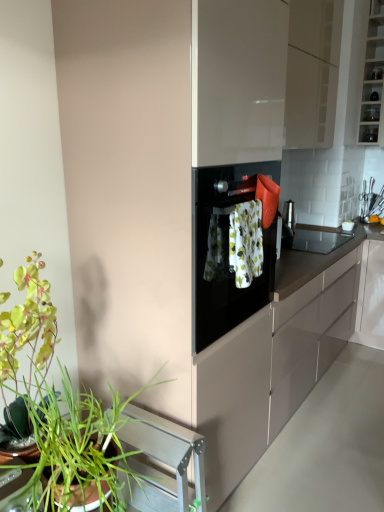
What is the approximate width of green leafy plant at lower left?

green leafy plant at lower left is 19.65 inches in width.

What is the approximate width of clear glass shelves at upper right, the first cabinetry in the right-to-left sequence?

The width of clear glass shelves at upper right, the first cabinetry in the right-to-left sequence, is 12.32 inches.

I want to click on green leafy plant at lower left, so click(x=50, y=394).

Is glossy beige cabinet at upper center, which appears as the second cabinetry when viewed from the right, further to camera compared to clear glass shelves at upper right, the first cabinetry in the right-to-left sequence?

No, glossy beige cabinet at upper center, which appears as the second cabinetry when viewed from the right, is in front of clear glass shelves at upper right, the first cabinetry in the right-to-left sequence.

The height and width of the screenshot is (512, 384). Identify the location of cabinetry on the left of clear glass shelves at upper right, the first cabinetry in the right-to-left sequence. (312, 72).

Considering the relative positions of glossy beige cabinet at upper center, which appears as the second cabinetry when viewed from the right, and clear glass shelves at upper right, marked as the 2th cabinetry in a left-to-right arrangement, in the image provided, is glossy beige cabinet at upper center, which appears as the second cabinetry when viewed from the right, to the left or to the right of clear glass shelves at upper right, marked as the 2th cabinetry in a left-to-right arrangement,?

glossy beige cabinet at upper center, which appears as the second cabinetry when viewed from the right, is to the left of clear glass shelves at upper right, marked as the 2th cabinetry in a left-to-right arrangement.

From the image's perspective, does floral fabric towel at center appear higher than glossy beige cabinet at upper center, which appears as the second cabinetry when viewed from the right?

No.

Can you confirm if floral fabric towel at center is positioned to the left of glossy beige cabinet at upper center, which appears as the second cabinetry when viewed from the right?

Yes, floral fabric towel at center is to the left of glossy beige cabinet at upper center, which appears as the second cabinetry when viewed from the right.

How different are the orientations of floral fabric towel at center and glossy beige cabinet at upper center, which is counted as the 1th cabinetry, starting from the left, in degrees?

They differ by 0.00367 degrees in their facing directions.

Could you tell me if floral fabric towel at center is facing glossy beige cabinet at upper center, which is counted as the 1th cabinetry, starting from the left?

No, floral fabric towel at center is not oriented towards glossy beige cabinet at upper center, which is counted as the 1th cabinetry, starting from the left.

Is green leafy plant at lower left spatially inside black matte countertop at center, or outside of it?

green leafy plant at lower left lies outside black matte countertop at center.

From the image's perspective, between green leafy plant at lower left and black matte countertop at center, who is located below?

green leafy plant at lower left.

From a real-world perspective, is green leafy plant at lower left above or below black matte countertop at center?

In terms of real-world spatial position, green leafy plant at lower left is above black matte countertop at center.

Between green leafy plant at lower left and black matte countertop at center, which one has smaller size?

green leafy plant at lower left.

Identify the location of laundry that appears above the green leafy plant at lower left (from a real-world perspective). The image size is (384, 512). (246, 242).

Based on the photo, in terms of size, does green leafy plant at lower left appear bigger or smaller than floral fabric towel at center?

In the image, green leafy plant at lower left appears to be larger than floral fabric towel at center.

From a real-world perspective, is green leafy plant at lower left on floral fabric towel at center?

No, from a real-world perspective, green leafy plant at lower left is not above floral fabric towel at center.

Is green leafy plant at lower left aimed at floral fabric towel at center?

No, green leafy plant at lower left is not aimed at floral fabric towel at center.

Can you confirm if green leafy plant at lower left is smaller than glossy beige cabinet at upper center, which is counted as the 1th cabinetry, starting from the left?

Indeed, green leafy plant at lower left has a smaller size compared to glossy beige cabinet at upper center, which is counted as the 1th cabinetry, starting from the left.

From the image's perspective, between green leafy plant at lower left and glossy beige cabinet at upper center, which is counted as the 1th cabinetry, starting from the left, who is located below?

green leafy plant at lower left.

Is green leafy plant at lower left far from glossy beige cabinet at upper center, which is counted as the 1th cabinetry, starting from the left?

Indeed, green leafy plant at lower left is not near glossy beige cabinet at upper center, which is counted as the 1th cabinetry, starting from the left.

Which is more to the left, green leafy plant at lower left or glossy beige cabinet at upper center, which is counted as the 1th cabinetry, starting from the left?

Positioned to the left is green leafy plant at lower left.

Does point (307, 330) lie behind point (39, 470)?

Yes, it is.

From the image's perspective, who appears lower, black matte countertop at center or green leafy plant at lower left?

green leafy plant at lower left, from the image's perspective.

Consider the image. Is black matte countertop at center facing towards green leafy plant at lower left?

No, black matte countertop at center is not aimed at green leafy plant at lower left.

Based on the photo, would you say green leafy plant at lower left is part of black matte countertop at center's contents?

No, green leafy plant at lower left is not inside black matte countertop at center.

Can you confirm if clear glass shelves at upper right, marked as the 2th cabinetry in a left-to-right arrangement, is thinner than green leafy plant at lower left?

Yes.

Would you consider clear glass shelves at upper right, marked as the 2th cabinetry in a left-to-right arrangement, to be distant from green leafy plant at lower left?

That's right, there is a large distance between clear glass shelves at upper right, marked as the 2th cabinetry in a left-to-right arrangement, and green leafy plant at lower left.

Is clear glass shelves at upper right, the first cabinetry in the right-to-left sequence, in front of or behind green leafy plant at lower left in the image?

In the image, clear glass shelves at upper right, the first cabinetry in the right-to-left sequence, appears behind green leafy plant at lower left.

I want to click on cabinetry on the left side of clear glass shelves at upper right, marked as the 2th cabinetry in a left-to-right arrangement, so click(x=312, y=72).

From the image's perspective, which cabinetry is the 1st one above the floral fabric towel at center? Please provide its 2D coordinates.

[(312, 72)]

Which object lies nearer to the anchor point glossy beige cabinet at upper center, which appears as the second cabinetry when viewed from the right, green leafy plant at lower left or clear glass shelves at upper right, the first cabinetry in the right-to-left sequence?

clear glass shelves at upper right, the first cabinetry in the right-to-left sequence.

Considering their positions, is clear glass shelves at upper right, the first cabinetry in the right-to-left sequence, positioned closer to glossy beige cabinet at upper center, which is counted as the 1th cabinetry, starting from the left, than black matte countertop at center?

clear glass shelves at upper right, the first cabinetry in the right-to-left sequence.

Based on their spatial positions, is green leafy plant at lower left or glossy beige cabinet at upper center, which is counted as the 1th cabinetry, starting from the left, further from floral fabric towel at center?

glossy beige cabinet at upper center, which is counted as the 1th cabinetry, starting from the left.

From the picture: Based on their spatial positions, is floral fabric towel at center or clear glass shelves at upper right, marked as the 2th cabinetry in a left-to-right arrangement, closer to green leafy plant at lower left?

Among the two, floral fabric towel at center is located nearer to green leafy plant at lower left.

Estimate the real-world distances between objects in this image. Which object is further from floral fabric towel at center, glossy beige cabinet at upper center, which is counted as the 1th cabinetry, starting from the left, or black matte countertop at center?

glossy beige cabinet at upper center, which is counted as the 1th cabinetry, starting from the left, is positioned further to the anchor floral fabric towel at center.

Looking at the image, which one is located closer to clear glass shelves at upper right, marked as the 2th cabinetry in a left-to-right arrangement, black matte countertop at center or glossy beige cabinet at upper center, which is counted as the 1th cabinetry, starting from the left?

glossy beige cabinet at upper center, which is counted as the 1th cabinetry, starting from the left.

Based on their spatial positions, is floral fabric towel at center or clear glass shelves at upper right, marked as the 2th cabinetry in a left-to-right arrangement, further from glossy beige cabinet at upper center, which appears as the second cabinetry when viewed from the right?

Among the two, floral fabric towel at center is located further to glossy beige cabinet at upper center, which appears as the second cabinetry when viewed from the right.

Considering their positions, is glossy beige cabinet at upper center, which is counted as the 1th cabinetry, starting from the left, positioned further to green leafy plant at lower left than clear glass shelves at upper right, marked as the 2th cabinetry in a left-to-right arrangement?

clear glass shelves at upper right, marked as the 2th cabinetry in a left-to-right arrangement, is positioned further to the anchor green leafy plant at lower left.

This screenshot has height=512, width=384. I want to click on countertop between glossy beige cabinet at upper center, which appears as the second cabinetry when viewed from the right, and green leafy plant at lower left in the up-down direction, so click(x=274, y=360).

Locate an element on the screen. laundry between green leafy plant at lower left and clear glass shelves at upper right, marked as the 2th cabinetry in a left-to-right arrangement, in the front-back direction is located at coordinates (246, 242).

This screenshot has width=384, height=512. I want to click on cabinetry between clear glass shelves at upper right, the first cabinetry in the right-to-left sequence, and black matte countertop at center from top to bottom, so click(x=312, y=72).

Image resolution: width=384 pixels, height=512 pixels. What are the coordinates of `laundry between green leafy plant at lower left and black matte countertop at center from left to right` in the screenshot? It's located at (246, 242).